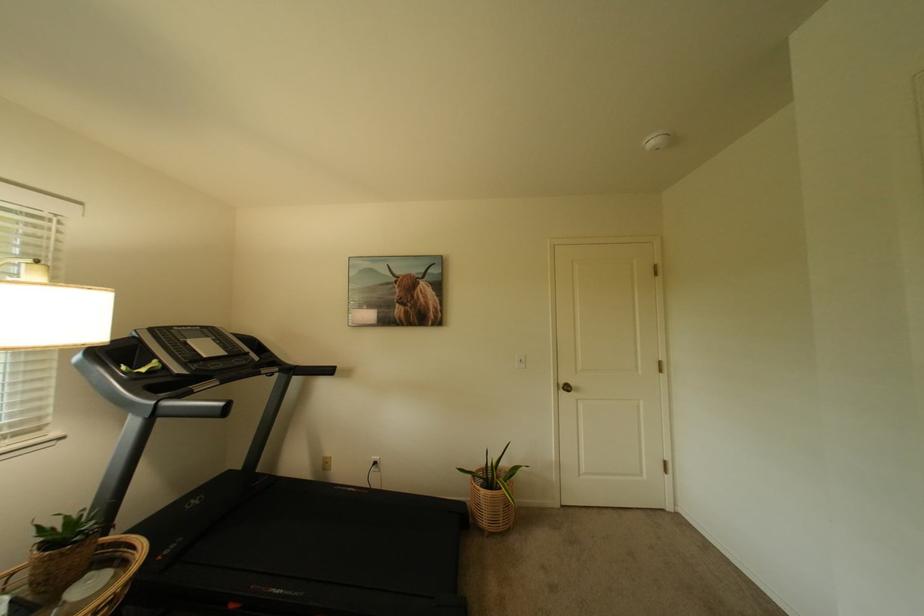
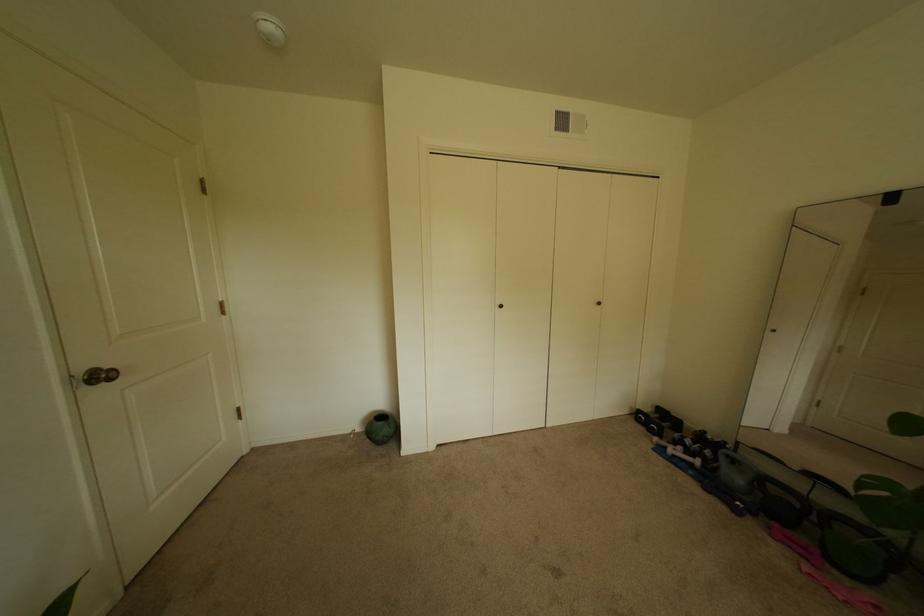
Question: The images are taken continuously from a first-person perspective. In which direction is your viewpoint rotating?

Choices:
 (A) Left
 (B) Right
 (C) Up
 (D) Down

Answer: (B)